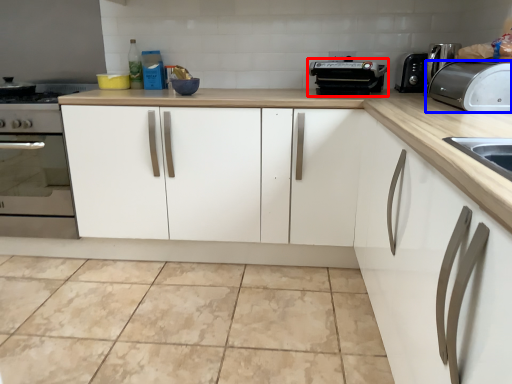
Question: Among these objects, which one is nearest to the camera, appliance (highlighted by a red box) or toaster (highlighted by a blue box)?

Choices:
 (A) appliance
 (B) toaster

Answer: (B)